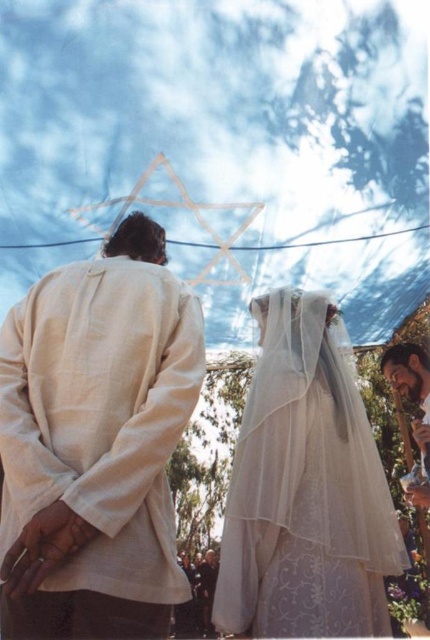
Can you confirm if light beige linen shirt at center is positioned below bearded man at lower right?

No.

Where is `light beige linen shirt at center`? The width and height of the screenshot is (430, 640). light beige linen shirt at center is located at coordinates (95, 442).

Based on the photo, is white sheer veil at center shorter than bearded man at lower right?

In fact, white sheer veil at center may be taller than bearded man at lower right.

Which is below, white sheer veil at center or bearded man at lower right?

white sheer veil at center is below.

Find the location of a particular element. white sheer veil at center is located at coordinates (306, 488).

Which is more to the left, light beige linen shirt at center or white sheer veil at center?

From the viewer's perspective, light beige linen shirt at center appears more on the left side.

You are a GUI agent. You are given a task and a screenshot of the screen. Output one action in this format:
    pyautogui.click(x=<x>, y=<y>)
    Task: Click on the light beige linen shirt at center
    The image size is (430, 640).
    Given the screenshot: What is the action you would take?
    pyautogui.click(x=95, y=442)

The height and width of the screenshot is (640, 430). In order to click on light beige linen shirt at center in this screenshot , I will do `click(95, 442)`.